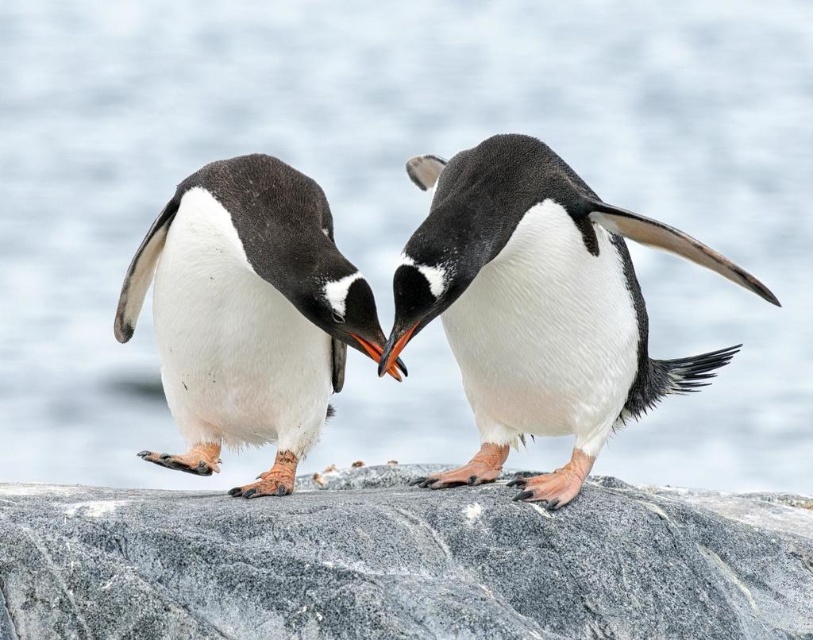
Question: Among these objects, which one is farthest from the camera?

Choices:
 (A) white fluffy penguin at center
 (B) white matte penguin at center
 (C) granite rock at center

Answer: (A)

Question: Which is nearer to the white fluffy penguin at center?

Choices:
 (A) granite rock at center
 (B) white matte penguin at center

Answer: (B)

Question: Is granite rock at center bigger than white fluffy penguin at center?

Choices:
 (A) no
 (B) yes

Answer: (B)

Question: Does granite rock at center appear on the left side of white matte penguin at center?

Choices:
 (A) no
 (B) yes

Answer: (B)

Question: Which point is farther to the camera?

Choices:
 (A) white matte penguin at center
 (B) white fluffy penguin at center
 (C) granite rock at center

Answer: (B)

Question: Can you confirm if granite rock at center is positioned below white fluffy penguin at center?

Choices:
 (A) no
 (B) yes

Answer: (B)